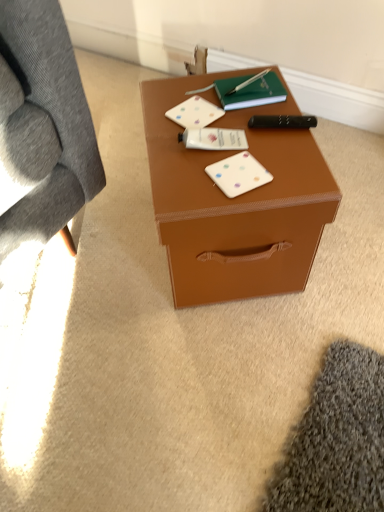
Where is `free space that is in between black plastic remote control at right and green matte notebook at upper center`? The image size is (384, 512). free space that is in between black plastic remote control at right and green matte notebook at upper center is located at coordinates (267, 115).